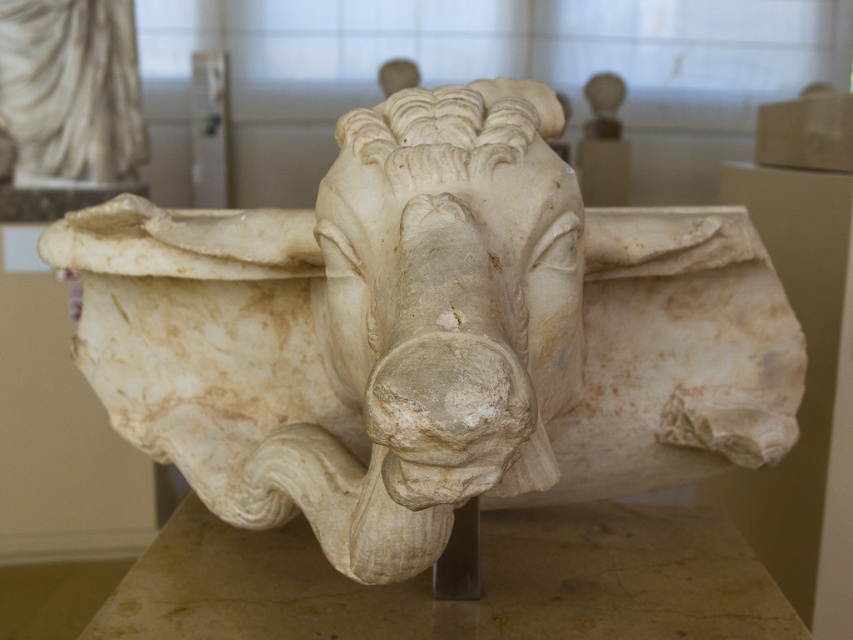
At what (x,y) coordinates should I click in order to perform the action: click on white marble bull at center. Please return your answer as a coordinate pair (x, y). This screenshot has width=853, height=640. Looking at the image, I should click on (432, 333).

Does white marble bull at center have a lesser width compared to white marble bull head at center?

No.

Between point (498, 432) and point (453, 186), which one is positioned behind?

The point (453, 186) is behind.

Identify the location of white marble bull at center. The image size is (853, 640). (432, 333).